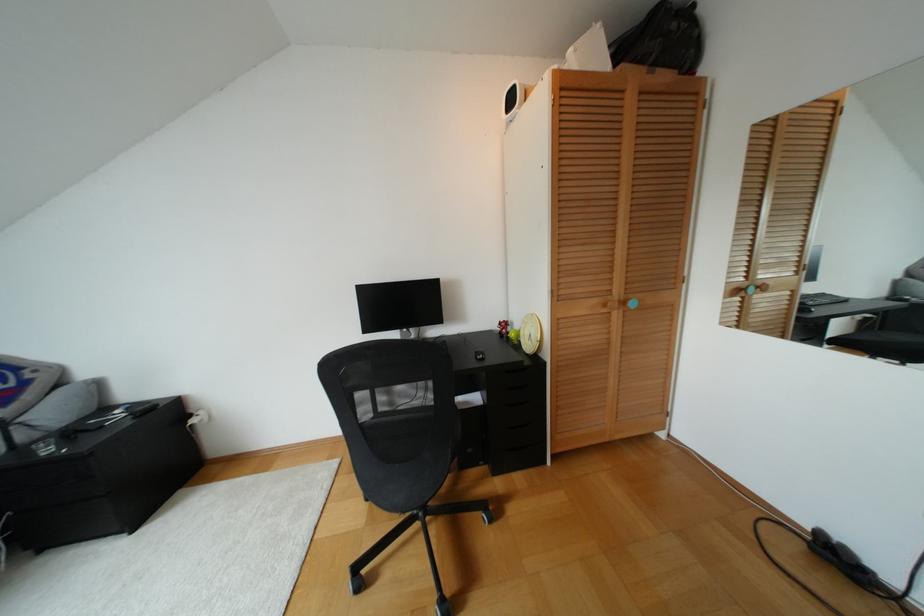
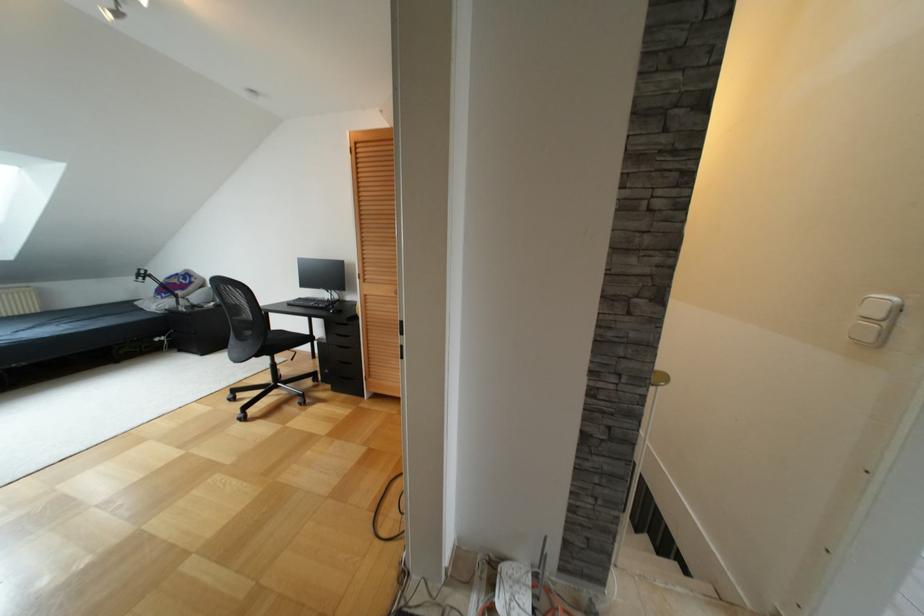
Question: What movement of the cameraman would produce the second image?

Choices:
 (A) Left
 (B) Right
 (C) Forward
 (D) Backward

Answer: (B)